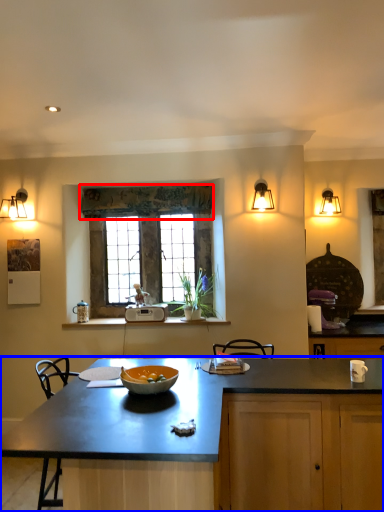
Question: Among these objects, which one is nearest to the camera, curtain (highlighted by a red box) or countertop (highlighted by a blue box)?

Choices:
 (A) curtain
 (B) countertop

Answer: (B)